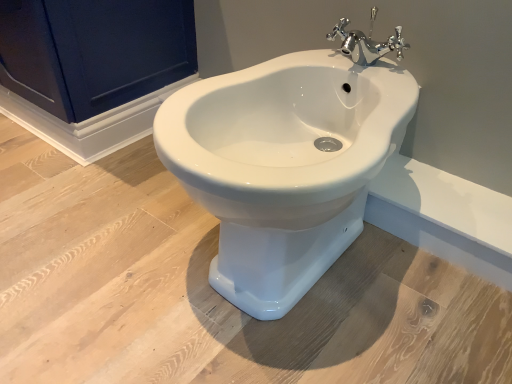
The image size is (512, 384). What are the coordinates of `vacant space underneath white glossy bidet at center (from a real-world perspective)` in the screenshot? It's located at (301, 290).